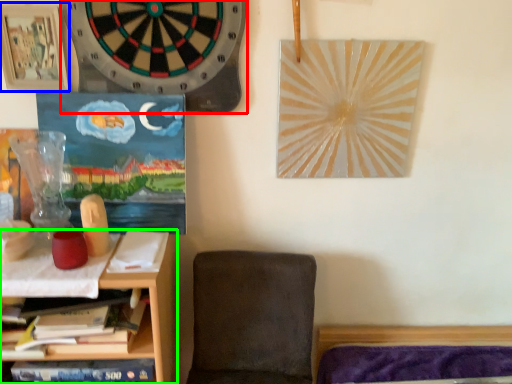
Question: Based on their relative distances, which object is farther from clock (highlighted by a red box)? Choose from picture frame (highlighted by a blue box) and shelf (highlighted by a green box).

Choices:
 (A) picture frame
 (B) shelf

Answer: (B)